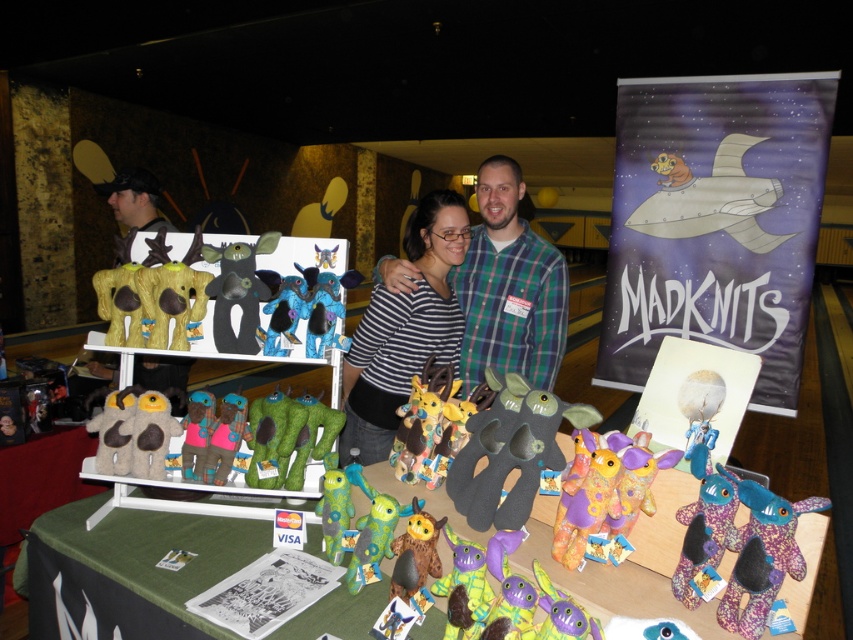
Is point (454, 288) positioned before point (148, 464)?

No, it is not.

Is plaid flannel shirt at center below fuzzy brown plush at center?

Incorrect, plaid flannel shirt at center is not positioned below fuzzy brown plush at center.

Who is more distant from viewer, (479, 364) or (141, 461)?

Positioned behind is point (479, 364).

Where is `plaid flannel shirt at center`? The height and width of the screenshot is (640, 853). plaid flannel shirt at center is located at coordinates (509, 285).

Is the position of plaid flannel shirt at center more distant than that of fluffy yellow plush at center?

Yes, it is.

Between point (474, 230) and point (432, 465), which one is positioned behind?

The point (474, 230) is behind.

Locate an element on the screen. plaid flannel shirt at center is located at coordinates [509, 285].

Can you confirm if green fabric table at center is shorter than matte black plush toy at center?

In fact, green fabric table at center may be taller than matte black plush toy at center.

Which of these two, green fabric table at center or matte black plush toy at center, stands shorter?

matte black plush toy at center

Which is behind, point (193, 589) or point (248, 262)?

Point (248, 262)

Image resolution: width=853 pixels, height=640 pixels. I want to click on green fabric table at center, so click(627, 564).